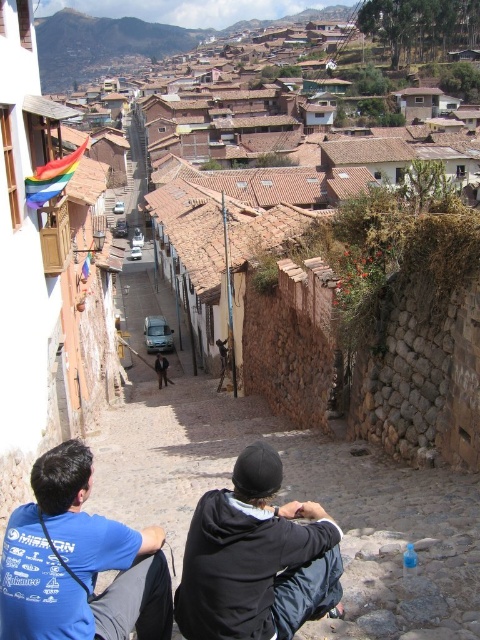
Is blue cotton t-shirt at lower left below black fleece jacket at center?

Correct, blue cotton t-shirt at lower left is located below black fleece jacket at center.

In order to click on blue cotton t-shirt at lower left in this screenshot , I will do `click(166, 561)`.

Who is more forward, (58, 625) or (251, 524)?

Point (58, 625) is in front.

Where is `blue cotton shirt at lower left`? The height and width of the screenshot is (640, 480). blue cotton shirt at lower left is located at coordinates (79, 563).

Who is more forward, (187, 550) or (15, 577)?

Positioned in front is point (15, 577).

Locate an element on the screen. This screenshot has width=480, height=640. blue cotton t-shirt at lower left is located at coordinates (166, 561).